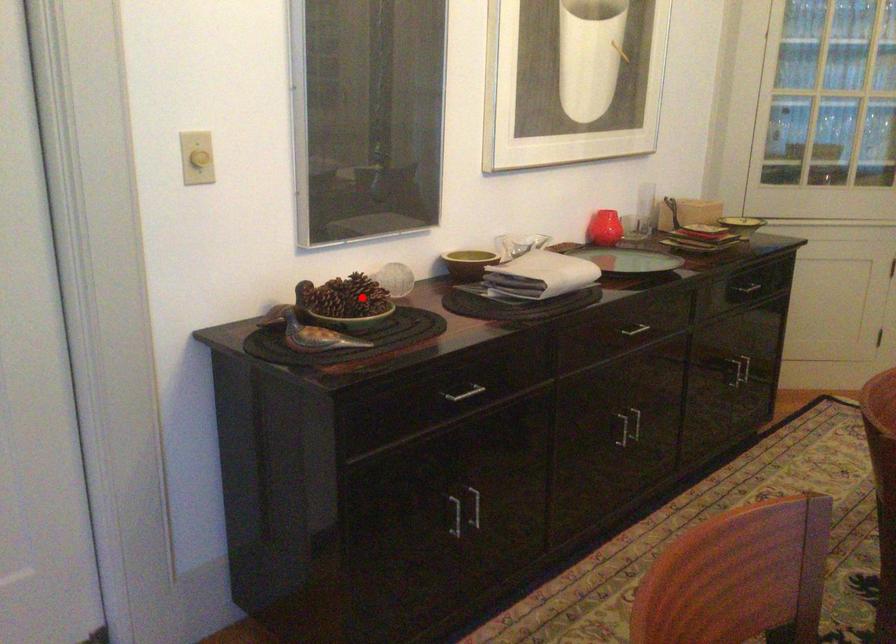
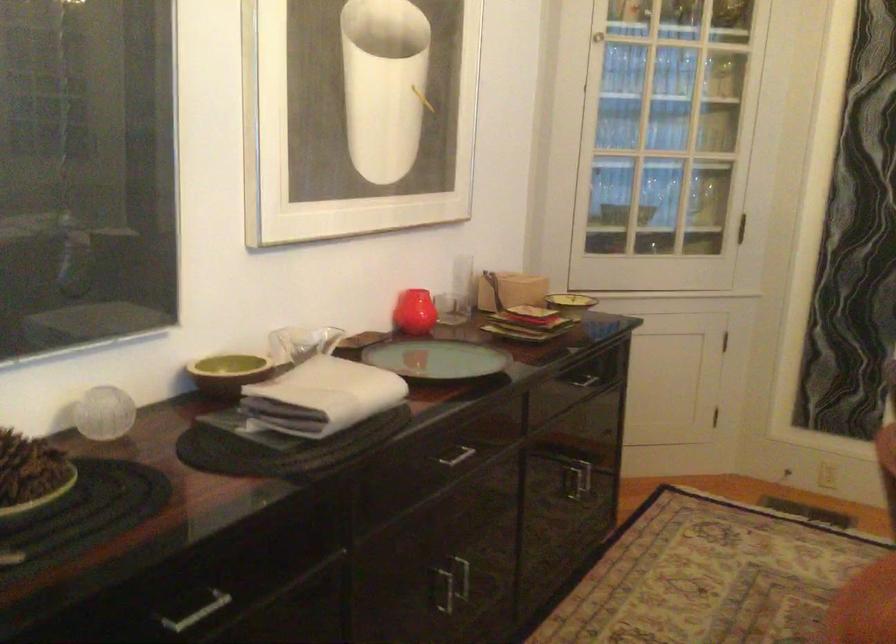
Question: A red point is marked in image1. In image2, is the corresponding 3D point closer to the camera or farther? Reply with the corresponding letter.

Choices:
 (A) The corresponding 3D point is closer.
 (B) The corresponding 3D point is farther.

Answer: (A)